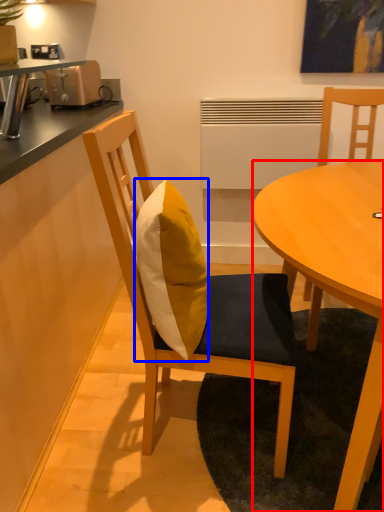
Question: Which object appears closest to the camera in this image, desk (highlighted by a red box) or pillow (highlighted by a blue box)?

Choices:
 (A) desk
 (B) pillow

Answer: (A)